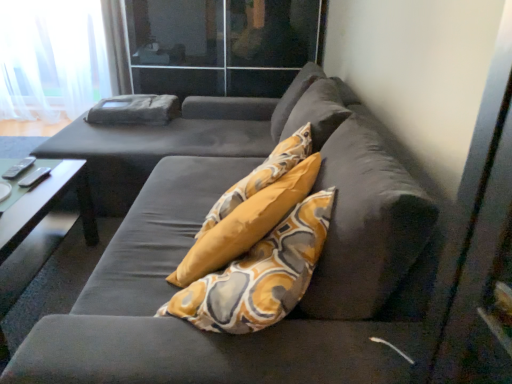
Question: Is velvet dark gray couch at center completely or partially outside of transparent glass door at upper center?

Choices:
 (A) no
 (B) yes

Answer: (B)

Question: From a real-world perspective, is velvet dark gray couch at center located higher than transparent glass door at upper center?

Choices:
 (A) no
 (B) yes

Answer: (A)

Question: From the image's perspective, does velvet dark gray couch at center appear higher than transparent glass door at upper center?

Choices:
 (A) no
 (B) yes

Answer: (A)

Question: Is transparent glass door at upper center completely or partially inside velvet dark gray couch at center?

Choices:
 (A) no
 (B) yes

Answer: (A)

Question: Is velvet dark gray couch at center wider than transparent glass door at upper center?

Choices:
 (A) yes
 (B) no

Answer: (A)

Question: Could you tell me if velvet dark gray couch at center is facing transparent glass door at upper center?

Choices:
 (A) yes
 (B) no

Answer: (B)

Question: Is the depth of green glossy table at lower left less than that of white sheer curtain at upper left?

Choices:
 (A) yes
 (B) no

Answer: (A)

Question: Is white sheer curtain at upper left surrounded by green glossy table at lower left?

Choices:
 (A) no
 (B) yes

Answer: (A)

Question: Can you confirm if green glossy table at lower left is wider than white sheer curtain at upper left?

Choices:
 (A) yes
 (B) no

Answer: (A)

Question: Is green glossy table at lower left not near white sheer curtain at upper left?

Choices:
 (A) no
 (B) yes

Answer: (B)

Question: Is green glossy table at lower left to the left of white sheer curtain at upper left from the viewer's perspective?

Choices:
 (A) yes
 (B) no

Answer: (B)

Question: Is green glossy table at lower left positioned with its back to white sheer curtain at upper left?

Choices:
 (A) yes
 (B) no

Answer: (B)

Question: Can you confirm if green glossy table at lower left is smaller than velvet dark gray couch at center?

Choices:
 (A) yes
 (B) no

Answer: (A)